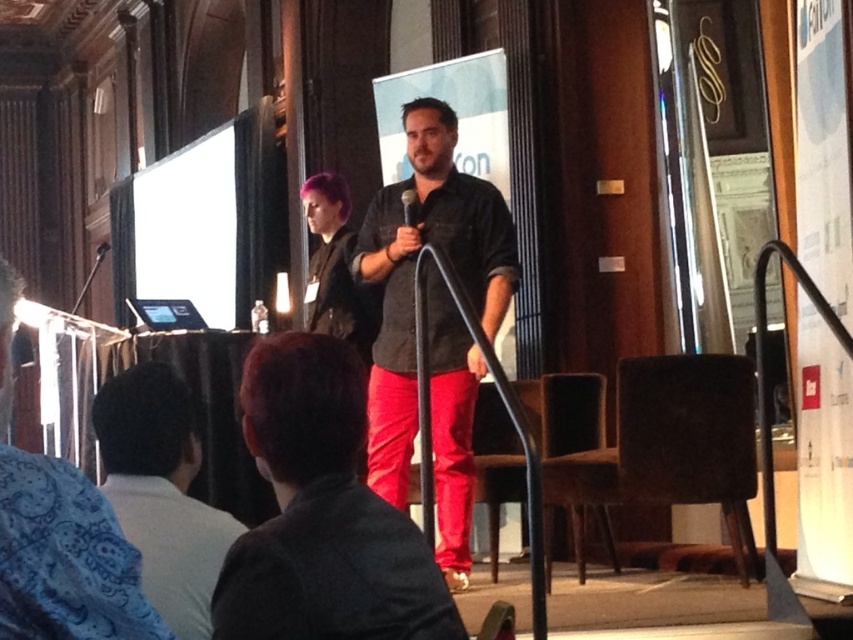
You are an attendee at the conference and want to take a photo of the speaker. The camera you have can only focus on objects taller than 1.5 meters. Can you focus on the matte black shirt at center or the black matte microphone at center?

The matte black shirt at center is taller than the black matte microphone at center. Since the camera focuses on objects taller than 1.5 meters, you can focus on the matte black shirt at center if it meets the height requirement, but the microphone may be too short.

You are an event planner organizing a presentation. You need to ensure that the speaker can move freely between the matte black shirt at center and the black matte microphone at center. Given that the speaker requires a minimum of 0.5 meters of space to move comfortably, can they navigate between these two items based on their sizes?

The matte black shirt at center is wider than the black matte microphone at center. Since the speaker requires 0.5 meters of space, the width difference allows sufficient room for movement between them.